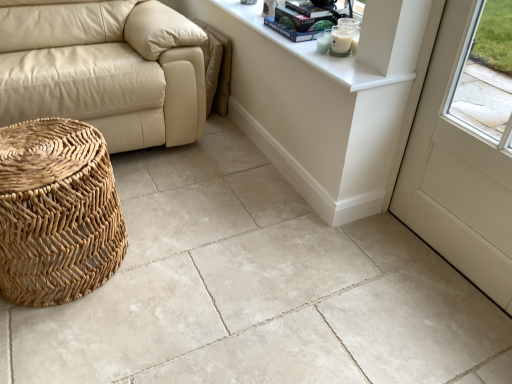
Question: From the image's perspective, is beige leather couch at left located above or below hardcover book at upper center, the first book positioned from the bottom?

Choices:
 (A) above
 (B) below

Answer: (B)

Question: Is beige leather couch at left bigger or smaller than hardcover book at upper center, positioned as the 2th book in top-to-bottom order?

Choices:
 (A) big
 (B) small

Answer: (A)

Question: Based on their relative distances, which object is nearer to the white glossy counter top at upper right?

Choices:
 (A) hardcover book at upper center, which is counted as the 2th book, starting from the bottom
 (B) white matte screen door at lower right
 (C) beige leather couch at left
 (D) natural woven basket at lower left
 (E) white glass candle at upper right

Answer: (A)

Question: Which object is positioned closest to the white glossy counter top at upper right?

Choices:
 (A) hardcover book at upper center, the first book from the top
 (B) beige leather couch at left
 (C) white glossy table at upper center
 (D) hardcover book at upper center, positioned as the 2th book in top-to-bottom order
 (E) white glass candle at upper right

Answer: (A)